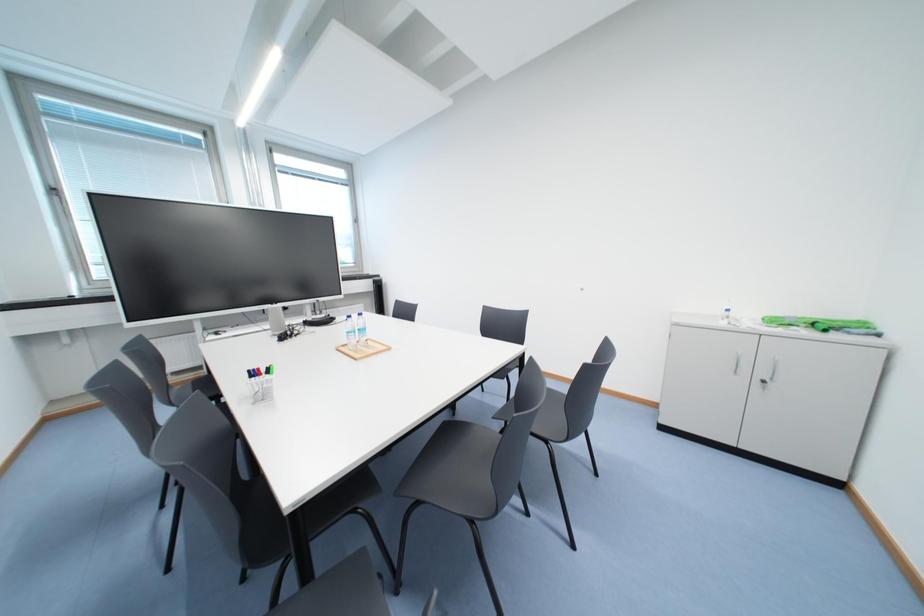
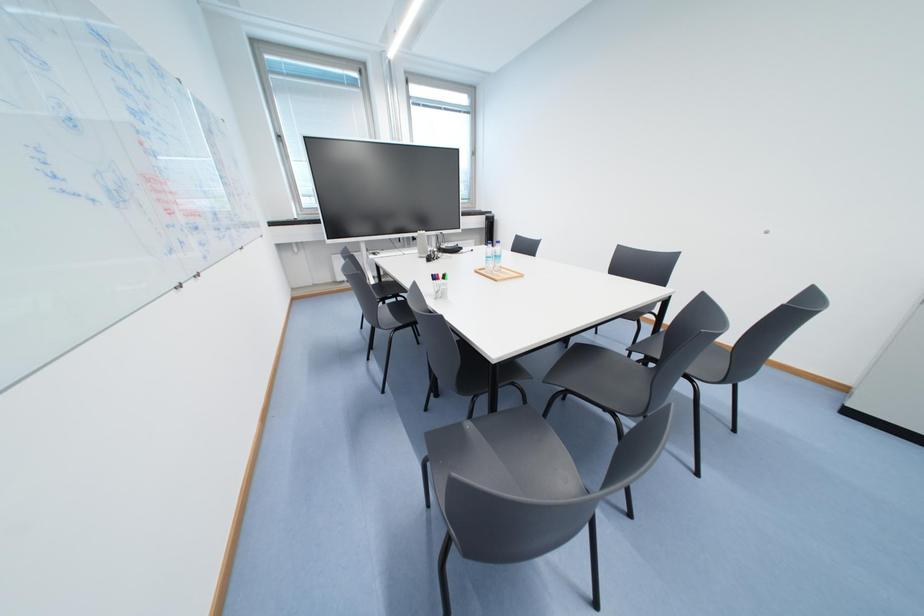
Question: The camera is either moving clockwise (left) or counter-clockwise (right) around the object. The first image is from the beginning of the video and the second image is from the end. Is the camera moving left or right when shooting the video?

Choices:
 (A) Left
 (B) Right

Answer: (B)